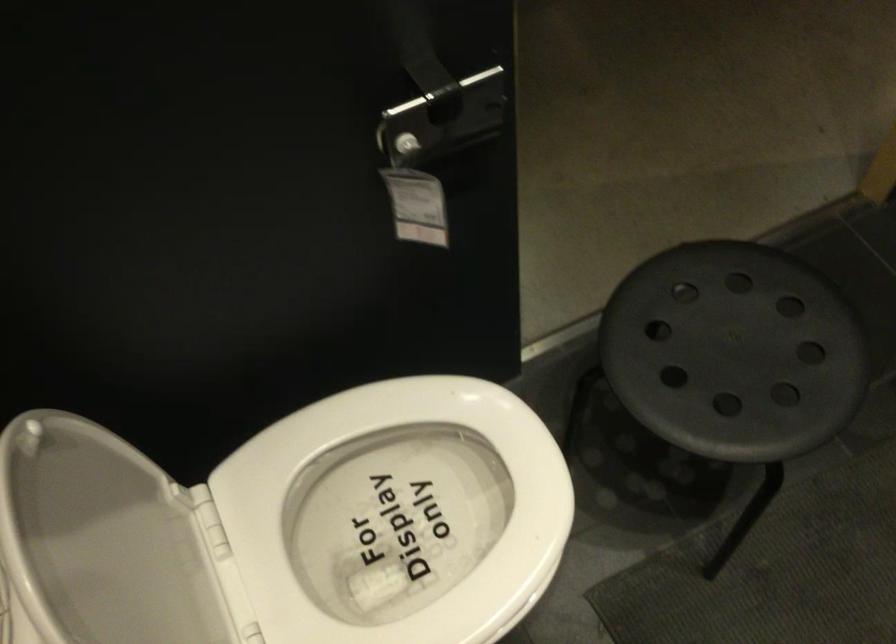
What do you see at coordinates (100, 540) in the screenshot? This screenshot has width=896, height=644. I see `the white toilet lid` at bounding box center [100, 540].